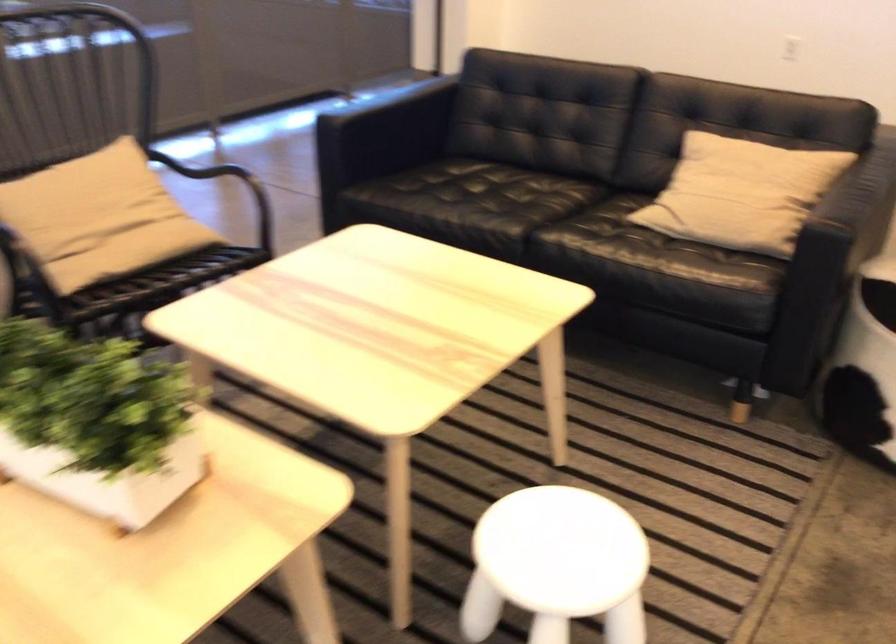
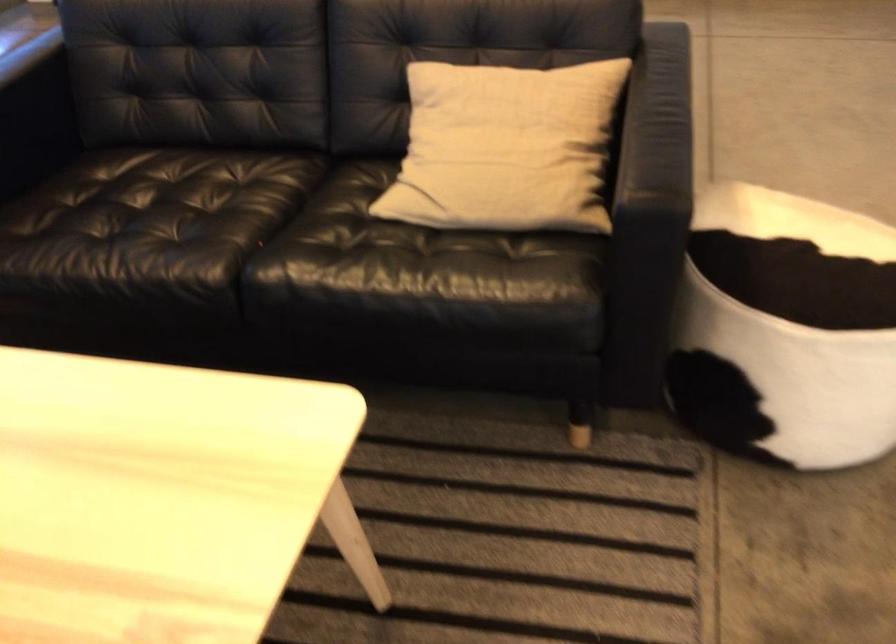
Question: The camera is either moving clockwise (left) or counter-clockwise (right) around the object. The first image is from the beginning of the video and the second image is from the end. Is the camera moving left or right when shooting the video?

Choices:
 (A) Left
 (B) Right

Answer: (A)